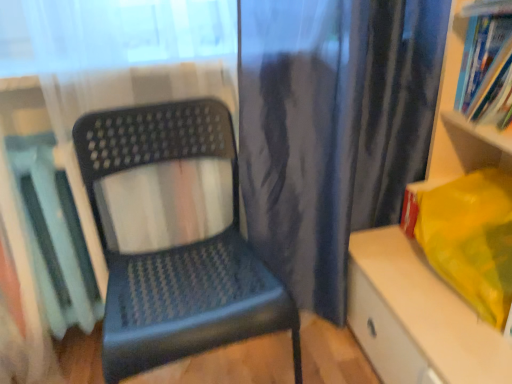
Question: Considering the relative positions of matte plastic chair at center and blue paperback book at upper right, the second book from the bottom, in the image provided, is matte plastic chair at center in front of blue paperback book at upper right, the second book from the bottom,?

Choices:
 (A) yes
 (B) no

Answer: (A)

Question: Is matte plastic chair at center to the left of blue paperback book at upper right, which appears as the second book when viewed from the left, from the viewer's perspective?

Choices:
 (A) no
 (B) yes

Answer: (B)

Question: From the image's perspective, is matte plastic chair at center over blue paperback book at upper right, which appears as the second book when viewed from the left?

Choices:
 (A) yes
 (B) no

Answer: (B)

Question: Does matte plastic chair at center have a lesser height compared to blue paperback book at upper right, the second book from the bottom?

Choices:
 (A) no
 (B) yes

Answer: (A)

Question: Is matte plastic chair at center turned away from blue paperback book at upper right, which appears as the second book when viewed from the left?

Choices:
 (A) no
 (B) yes

Answer: (A)

Question: Is blue paperback book at upper right, which is counted as the 1th book, starting from the top, wider or thinner than matte plastic shelf at right, the 1th shelf from the bottom?

Choices:
 (A) thin
 (B) wide

Answer: (A)

Question: Based on their sizes in the image, would you say blue paperback book at upper right, which is counted as the 1th book, starting from the top, is bigger or smaller than matte plastic shelf at right, arranged as the second shelf when viewed from the top?

Choices:
 (A) big
 (B) small

Answer: (B)

Question: Which is correct: blue paperback book at upper right, which is counted as the 1th book, starting from the right, is inside matte plastic shelf at right, the 1th shelf from the bottom, or outside of it?

Choices:
 (A) inside
 (B) outside

Answer: (A)

Question: In the image, is blue paperback book at upper right, which appears as the second book when viewed from the left, on the left side or the right side of matte plastic shelf at right, arranged as the second shelf when viewed from the top?

Choices:
 (A) left
 (B) right

Answer: (B)

Question: Is matte plastic book at left, positioned as the 1th book in left-to-right order, in front of or behind blue paperback book at upper right, which appears as the second book when viewed from the left, in the image?

Choices:
 (A) front
 (B) behind

Answer: (A)

Question: Is matte plastic book at left, the 1th book positioned from the bottom, to the left or to the right of blue paperback book at upper right, which is counted as the 1th book, starting from the right, in the image?

Choices:
 (A) right
 (B) left

Answer: (B)

Question: Looking at their shapes, would you say matte plastic book at left, the 1th book positioned from the bottom, is wider or thinner than blue paperback book at upper right, the second book from the bottom?

Choices:
 (A) wide
 (B) thin

Answer: (A)

Question: Choose the correct answer: Is matte plastic book at left, the 1th book positioned from the bottom, inside blue paperback book at upper right, which appears as the second book when viewed from the left, or outside it?

Choices:
 (A) inside
 (B) outside

Answer: (B)

Question: Is matte plastic chair at center spatially inside blue paperback book at upper right, which appears as the second book when viewed from the left, or outside of it?

Choices:
 (A) outside
 (B) inside

Answer: (A)

Question: In terms of size, does matte plastic chair at center appear bigger or smaller than blue paperback book at upper right, which appears as the second book when viewed from the left?

Choices:
 (A) big
 (B) small

Answer: (A)